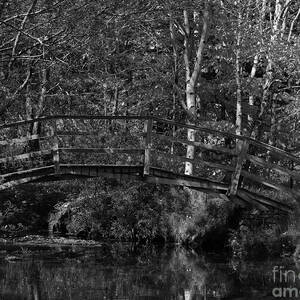
Identify the location of vertical wood piece. This screenshot has height=300, width=300. (54, 137), (148, 141), (236, 164).